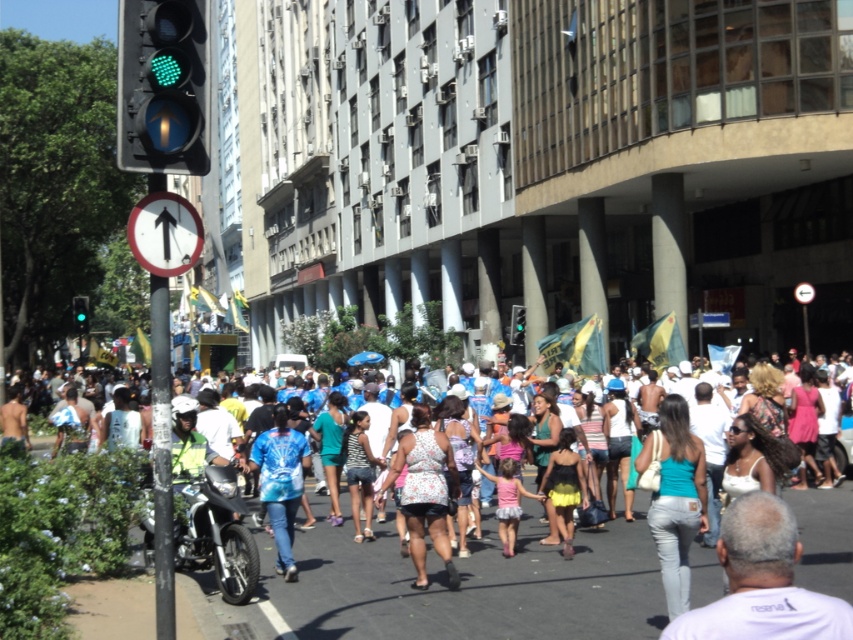
Question: Which object is positioned closest to the white cotton shirt at center?

Choices:
 (A) shiny black motorcycle at lower left
 (B) denim jeans at center
 (C) tie-dye shirt at center
 (D) pink tulle skirt at center

Answer: (D)

Question: Among these points, which one is farthest from the camera?

Choices:
 (A) (80, 324)
 (B) (281, 480)
 (C) (143, 33)

Answer: (A)

Question: Does denim jeans at center have a smaller size compared to green glass traffic light at left?

Choices:
 (A) no
 (B) yes

Answer: (B)

Question: Does white cotton shirt at center appear on the left side of denim jeans at center?

Choices:
 (A) yes
 (B) no

Answer: (B)

Question: From the image, what is the correct spatial relationship of shiny black motorcycle at lower left in relation to denim jeans at center?

Choices:
 (A) below
 (B) above

Answer: (A)

Question: Among these objects, which one is farthest from the camera?

Choices:
 (A) denim jeans at center
 (B) shiny black motorcycle at lower left
 (C) white cotton shirt at center
 (D) green glass traffic light at left

Answer: (D)